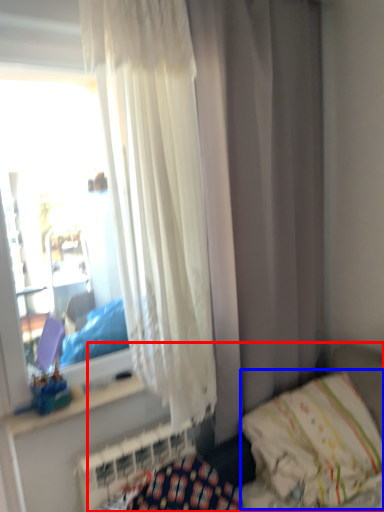
Question: Which point is further to the camera, hospital bed (highlighted by a red box) or pillow (highlighted by a blue box)?

Choices:
 (A) hospital bed
 (B) pillow

Answer: (B)